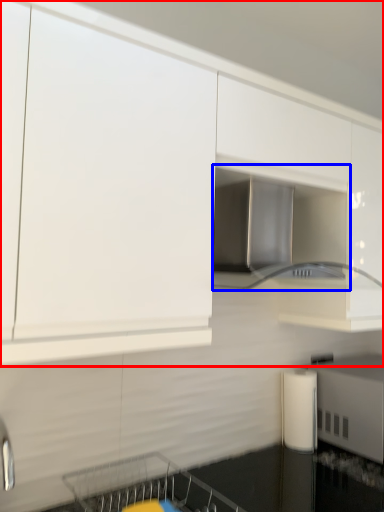
Question: Which object is closer to the camera taking this photo, cabinetry (highlighted by a red box) or home appliance (highlighted by a blue box)?

Choices:
 (A) cabinetry
 (B) home appliance

Answer: (A)